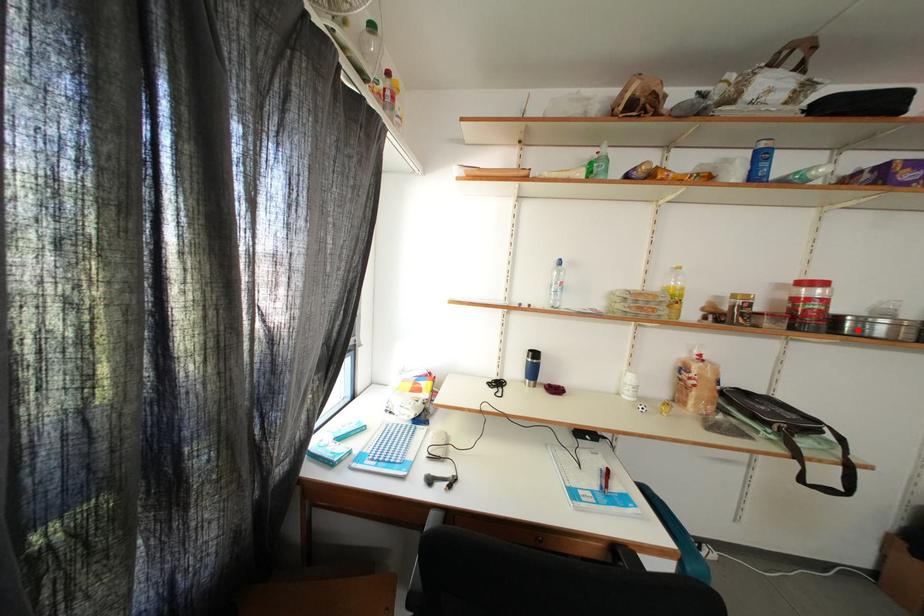
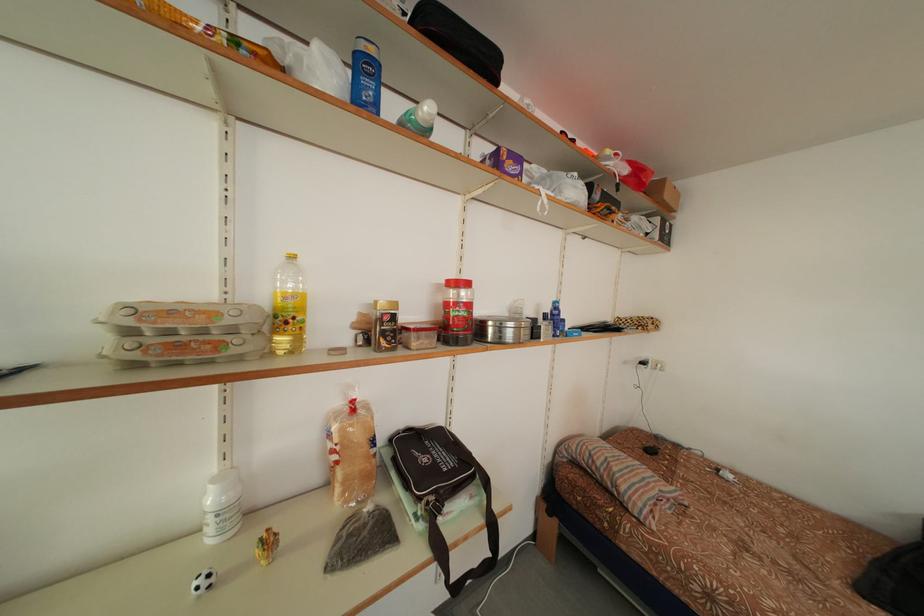
Where in the second image is the point corresponding to the highlighted location from the first image?

(499, 334)